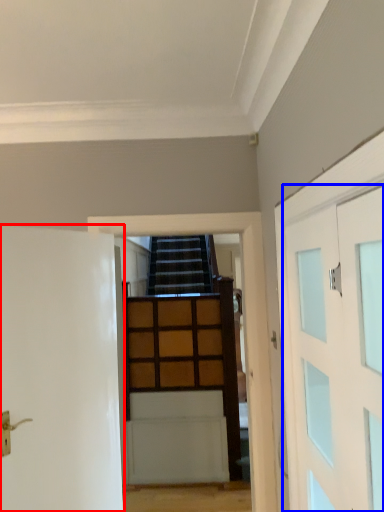
Question: Which point is further to the camera, door (highlighted by a red box) or door (highlighted by a blue box)?

Choices:
 (A) door
 (B) door

Answer: (A)